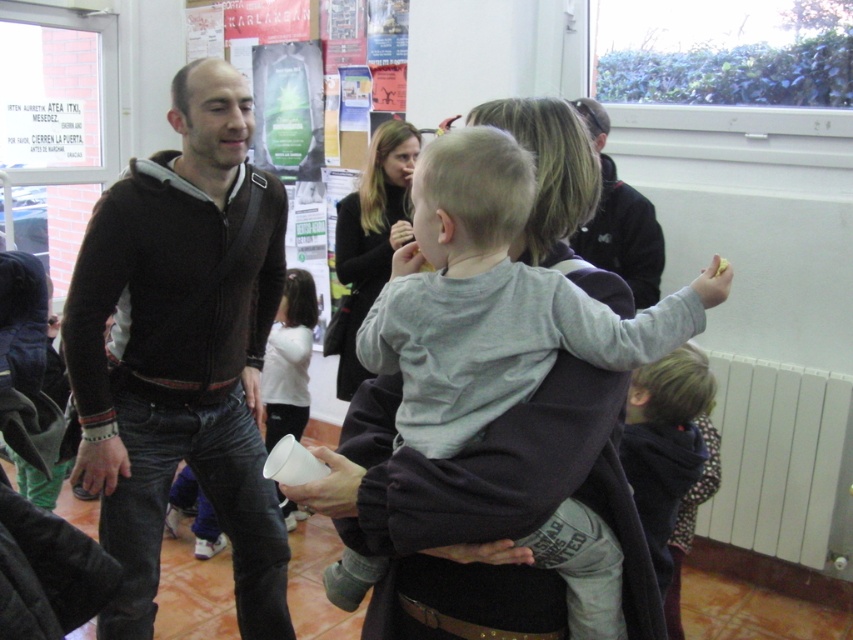
Question: Which of the following is the farthest from the observer?

Choices:
 (A) (437, 323)
 (B) (137, 570)

Answer: (B)

Question: Considering the relative positions of black zip-up hoodie at left and gray cotton shirt at center in the image provided, where is black zip-up hoodie at left located with respect to gray cotton shirt at center?

Choices:
 (A) below
 (B) above

Answer: (A)

Question: Considering the real-world distances, which object is closest to the gray cotton shirt at center?

Choices:
 (A) black jacket at upper center
 (B) light brown hair at lower right

Answer: (B)

Question: Which of the following is the closest to the observer?

Choices:
 (A) gray cotton shirt at center
 (B) light brown hair at lower right
 (C) black jacket at upper center

Answer: (A)

Question: Does black zip-up hoodie at left lie in front of gray cotton shirt at center?

Choices:
 (A) yes
 (B) no

Answer: (B)

Question: Is gray cotton shirt at center positioned in front of black jacket at upper center?

Choices:
 (A) no
 (B) yes

Answer: (B)